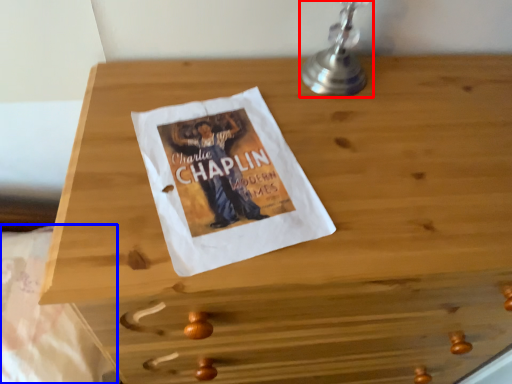
Question: Among these objects, which one is nearest to the camera, table lamp (highlighted by a red box) or sheet (highlighted by a blue box)?

Choices:
 (A) table lamp
 (B) sheet

Answer: (A)